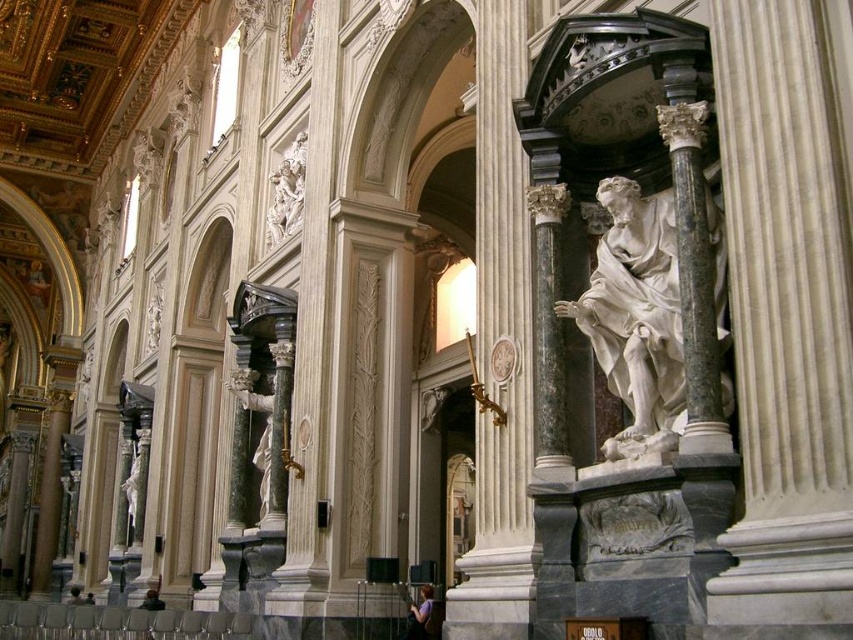
Is point (657, 208) farther from camera compared to point (289, 176)?

No, it is not.

Is point (619, 177) closer to viewer compared to point (283, 168)?

That is True.

Image resolution: width=853 pixels, height=640 pixels. Find the location of `white marble statue at center`. white marble statue at center is located at coordinates (636, 316).